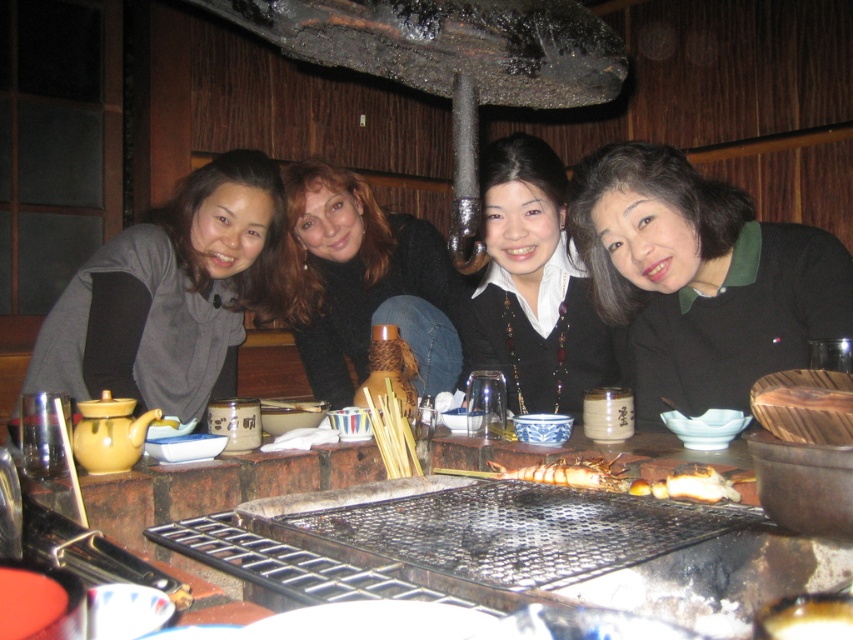
Is metal grill at center to the right of shiny brown shrimp at center from the viewer's perspective?

No, metal grill at center is not to the right of shiny brown shrimp at center.

Between point (741, 600) and point (598, 461), which one is positioned behind?

Positioned behind is point (598, 461).

Is point (693, 605) positioned in front of point (619, 486)?

That is True.

This screenshot has height=640, width=853. Find the location of `metal grill at center`. metal grill at center is located at coordinates tap(552, 547).

How distant is matte gray sweater at center from smooth black sweater at center?

matte gray sweater at center is 13.23 inches away from smooth black sweater at center.

Is matte gray sweater at center bigger than smooth black sweater at center?

No, matte gray sweater at center is not bigger than smooth black sweater at center.

Locate an element on the screen. The height and width of the screenshot is (640, 853). matte gray sweater at center is located at coordinates [170, 294].

Who is positioned more to the right, matte gray sweater at center or black matte necklace at center?

black matte necklace at center

How far apart are matte gray sweater at center and black matte necklace at center?

matte gray sweater at center is 30.68 inches away from black matte necklace at center.

I want to click on matte gray sweater at center, so click(170, 294).

Locate an element on the screen. matte gray sweater at center is located at coordinates (170, 294).